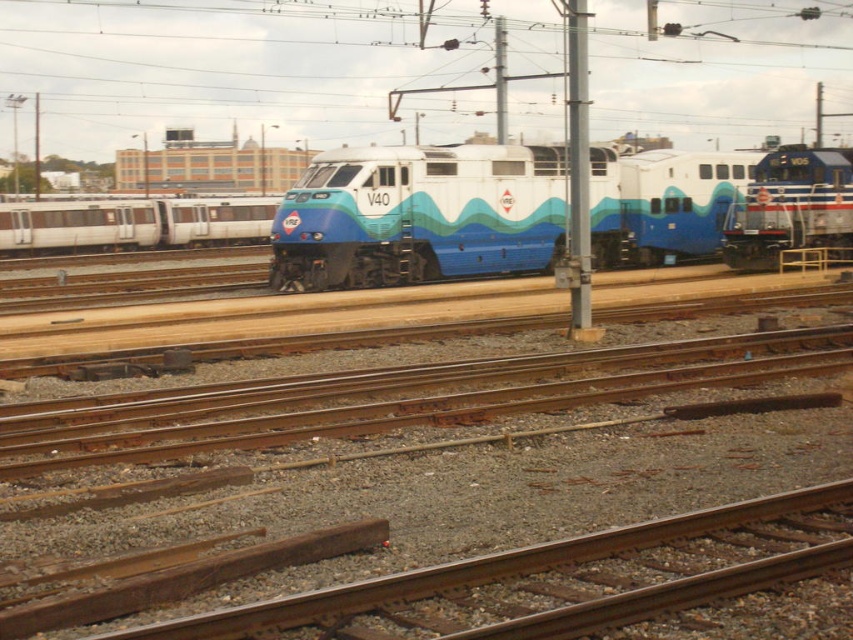
Question: Is rusty metal track at center wider than blue glossy locomotive at right?

Choices:
 (A) yes
 (B) no

Answer: (A)

Question: Is silver metallic train car at left thinner than blue glossy locomotive at right?

Choices:
 (A) yes
 (B) no

Answer: (B)

Question: Which object is farther from the camera taking this photo?

Choices:
 (A) rusty metal track at center
 (B) matte blue train at center

Answer: (B)

Question: Which point is closer to the camera taking this photo?

Choices:
 (A) (349, 173)
 (B) (798, 237)
 (C) (184, 627)

Answer: (C)

Question: Can you confirm if matte blue train at center is wider than silver metallic train car at left?

Choices:
 (A) yes
 (B) no

Answer: (A)

Question: Which point is farther to the camera?

Choices:
 (A) blue glossy locomotive at right
 (B) silver metallic train car at left
 (C) rusty metal track at center

Answer: (B)